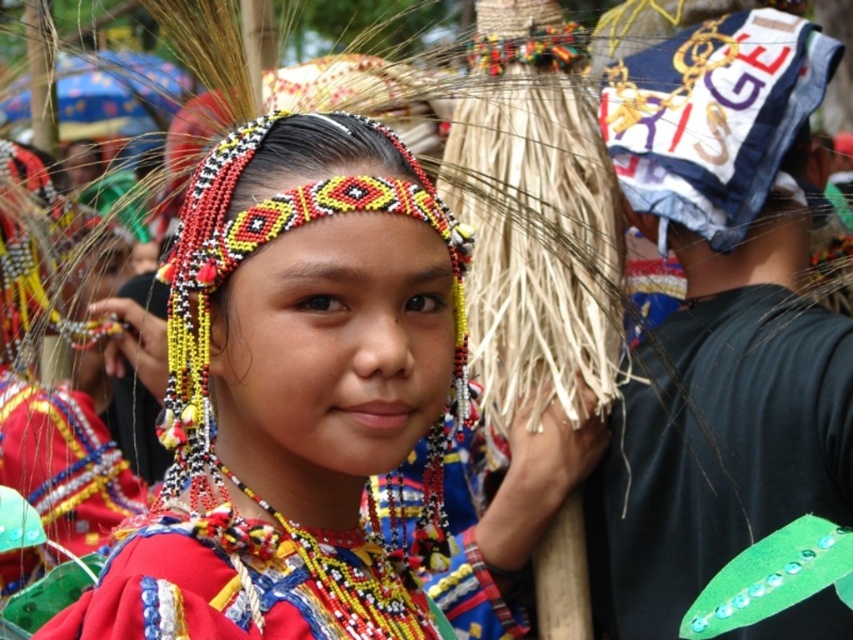
Does beaded headband at center come behind beaded fabric necklace at center?

Yes, it is behind beaded fabric necklace at center.

Is beaded headband at center to the right of beaded fabric necklace at center from the viewer's perspective?

Correct, you'll find beaded headband at center to the right of beaded fabric necklace at center.

This screenshot has height=640, width=853. Find the location of `beaded headband at center`. beaded headband at center is located at coordinates (294, 396).

Which is below, beaded headband at center or green beaded leaf at right?

green beaded leaf at right is lower down.

What do you see at coordinates (294, 396) in the screenshot? The image size is (853, 640). I see `beaded headband at center` at bounding box center [294, 396].

Which is behind, point (155, 586) or point (585, 493)?

The point (585, 493) is behind.

Locate an element on the screen. beaded headband at center is located at coordinates (294, 396).

What do you see at coordinates (717, 451) in the screenshot? The image size is (853, 640). I see `green beaded leaf at right` at bounding box center [717, 451].

Can you confirm if green beaded leaf at right is positioned to the left of beaded fabric necklace at center?

In fact, green beaded leaf at right is to the right of beaded fabric necklace at center.

Is point (747, 380) positioned after point (253, 550)?

Yes.

Identify the location of green beaded leaf at right. (717, 451).